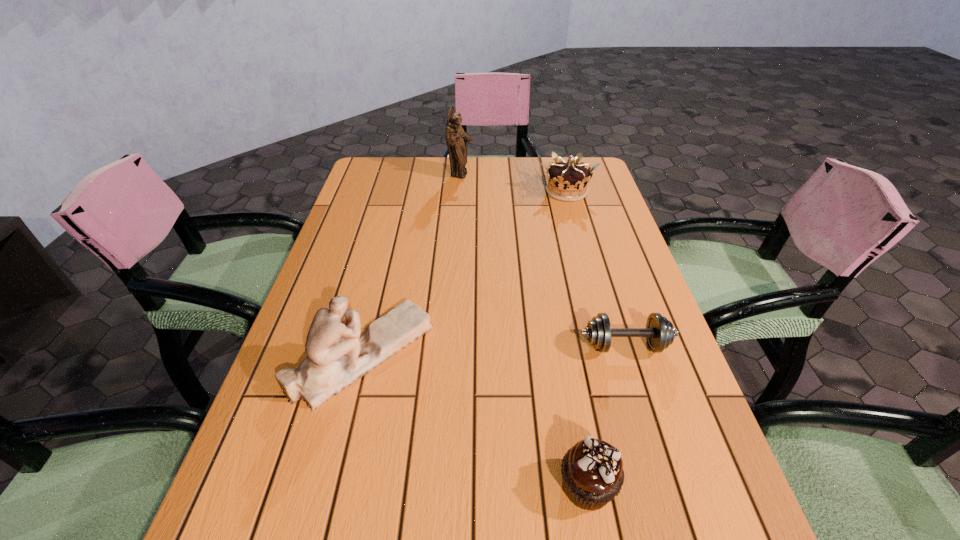
Where is `free area in between the crown and the second tallest object`? This screenshot has width=960, height=540. free area in between the crown and the second tallest object is located at coordinates (465, 273).

Image resolution: width=960 pixels, height=540 pixels. Find the location of `vacant space in between the taller figurine and the cupcake`. vacant space in between the taller figurine and the cupcake is located at coordinates (524, 330).

Locate an element on the screen. Image resolution: width=960 pixels, height=540 pixels. free space between the nearer figurine and the crown is located at coordinates (465, 273).

Identify which object is the second closest to the third tallest object. Please provide its 2D coordinates. Your answer should be formatted as a tuple, i.e. [(x, y)], where the tuple contains the x and y coordinates of a point satisfying the conditions above.

[(659, 332)]

Select which object appears as the closest to the dumbbell. Please provide its 2D coordinates. Your answer should be formatted as a tuple, i.e. [(x, y)], where the tuple contains the x and y coordinates of a point satisfying the conditions above.

[(592, 471)]

Identify the location of vacant position in the image that satisfies the following two spatial constraints: 1. on the front-facing side of the tallest object; 2. on the right side of the dumbbell. The height and width of the screenshot is (540, 960). (450, 346).

Locate an element on the screen. The height and width of the screenshot is (540, 960). vacant space that satisfies the following two spatial constraints: 1. on the back side of the second shortest object; 2. on the left side of the third shortest object is located at coordinates (535, 191).

This screenshot has height=540, width=960. Find the location of `free region that satisfies the following two spatial constraints: 1. on the front-facing side of the fourth tallest object; 2. on the left side of the shorter figurine`. free region that satisfies the following two spatial constraints: 1. on the front-facing side of the fourth tallest object; 2. on the left side of the shorter figurine is located at coordinates (329, 485).

Where is `blank space that satisfies the following two spatial constraints: 1. on the front side of the shortest object; 2. on the front-facing side of the nearer figurine`? Image resolution: width=960 pixels, height=540 pixels. blank space that satisfies the following two spatial constraints: 1. on the front side of the shortest object; 2. on the front-facing side of the nearer figurine is located at coordinates (x=628, y=354).

Locate an element on the screen. Image resolution: width=960 pixels, height=540 pixels. vacant space that satisfies the following two spatial constraints: 1. on the back side of the third shortest object; 2. on the front-facing side of the tallest object is located at coordinates (563, 175).